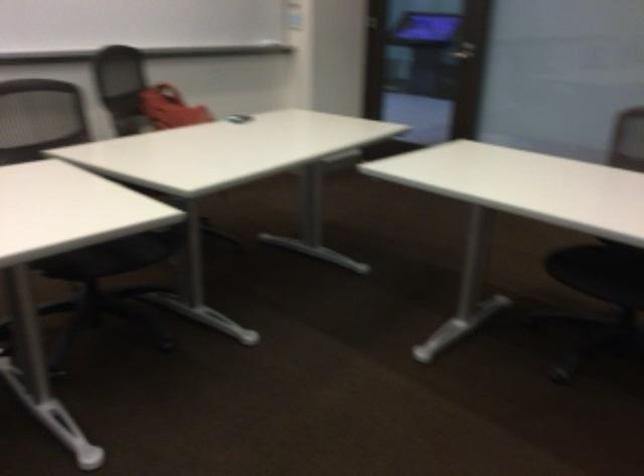
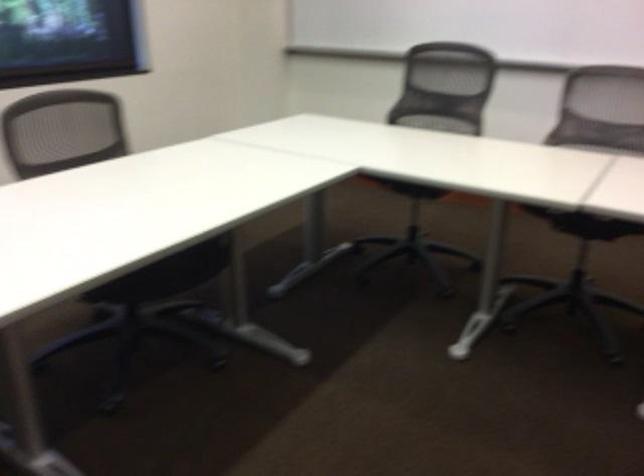
Question: How did the camera likely rotate?

Choices:
 (A) Left
 (B) Right
 (C) Up
 (D) Down

Answer: (A)